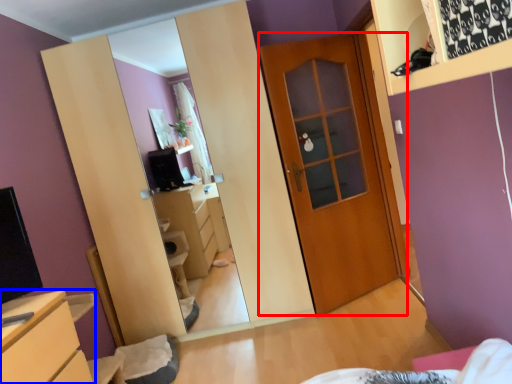
Question: Which point is closer to the camera, door (highlighted by a red box) or chest of drawers (highlighted by a blue box)?

Choices:
 (A) door
 (B) chest of drawers

Answer: (B)